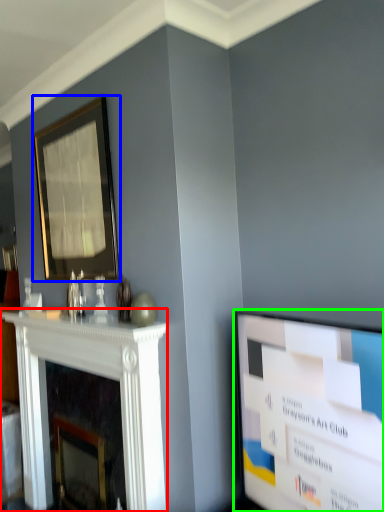
Question: Estimate the real-world distances between objects in this image. Which object is farther from fireplace (highlighted by a red box), picture frame (highlighted by a blue box) or television (highlighted by a green box)?

Choices:
 (A) picture frame
 (B) television

Answer: (B)